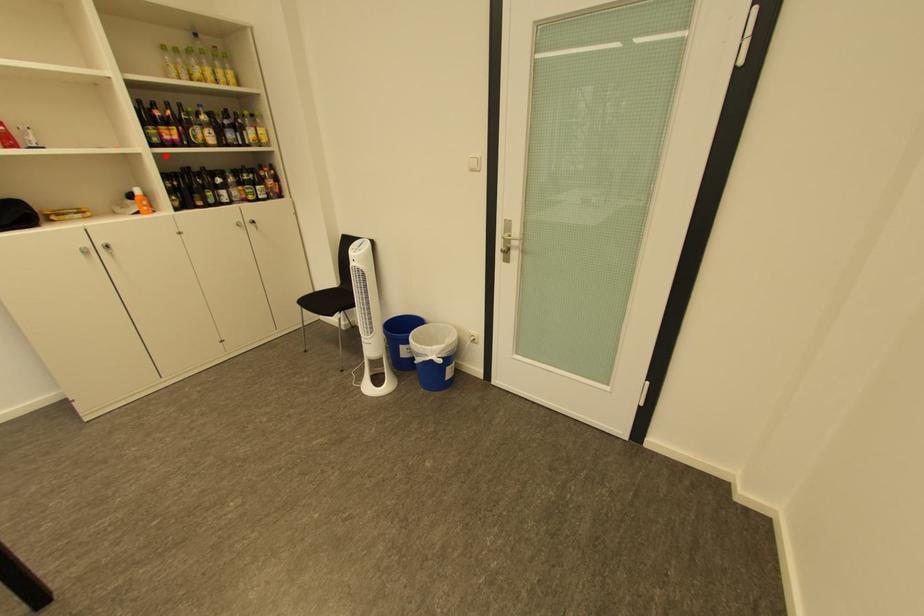
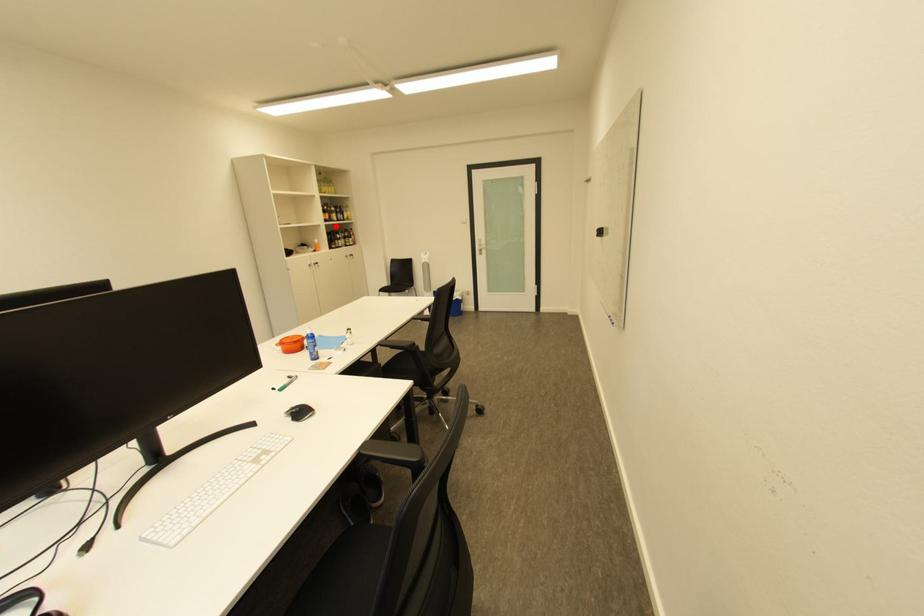
I am providing you with two images of the same scene from different viewpoints. A red point is marked on the first image and another point is marked on the second image. Does the point marked in image1 correspond to the same location as the one in image2?

Yes